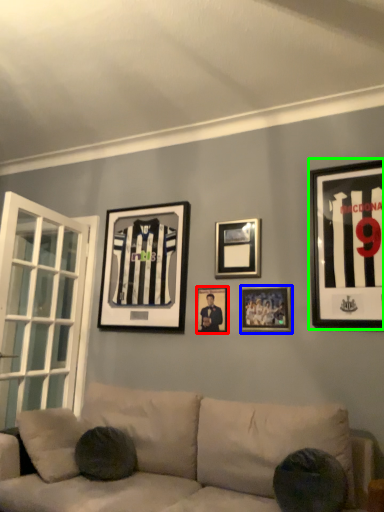
Question: Based on their relative distances, which object is nearer to picture frame (highlighted by a red box)? Choose from picture frame (highlighted by a blue box) and picture frame (highlighted by a green box).

Choices:
 (A) picture frame
 (B) picture frame

Answer: (A)